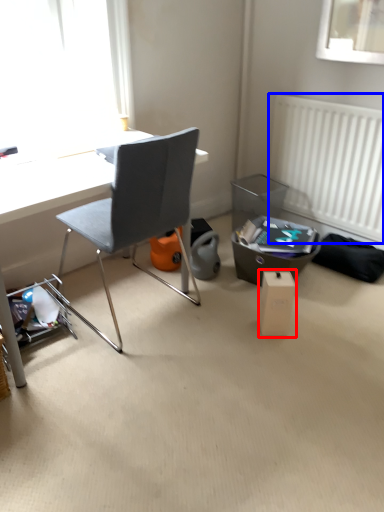
Question: Among these objects, which one is nearest to the camera, cardboard box (highlighted by a red box) or radiator (highlighted by a blue box)?

Choices:
 (A) cardboard box
 (B) radiator

Answer: (A)